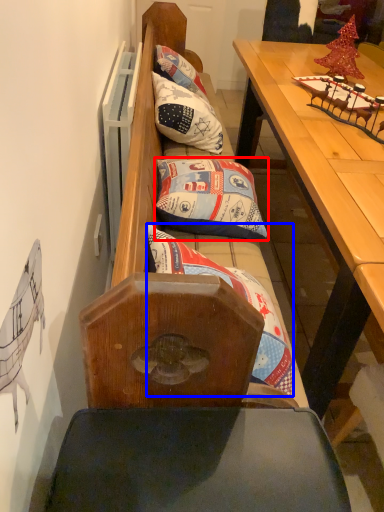
Question: Which of the following is the closest to the observer, pillow (highlighted by a red box) or pillow (highlighted by a blue box)?

Choices:
 (A) pillow
 (B) pillow

Answer: (B)